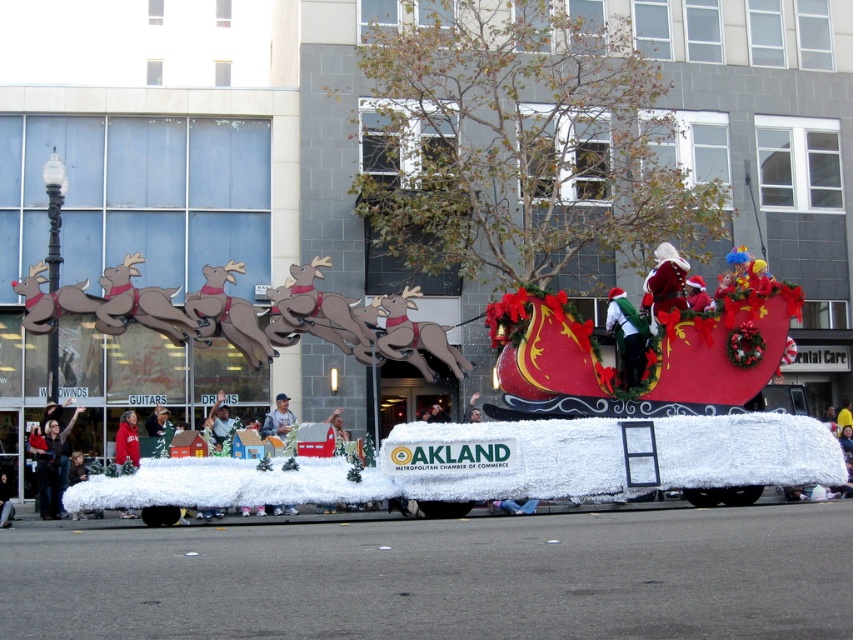
The width and height of the screenshot is (853, 640). Describe the element at coordinates (51, 458) in the screenshot. I see `dark gray sweater at lower left` at that location.

Which is more to the left, dark gray sweater at lower left or velvet santa hat at center?

From the viewer's perspective, dark gray sweater at lower left appears more on the left side.

Is point (53, 440) behind point (616, 300)?

Yes.

You are a GUI agent. You are given a task and a screenshot of the screen. Output one action in this format:
    pyautogui.click(x=<x>, y=<y>)
    Task: Click on the dark gray sweater at lower left
    This screenshot has width=853, height=640.
    Given the screenshot: What is the action you would take?
    pyautogui.click(x=51, y=458)